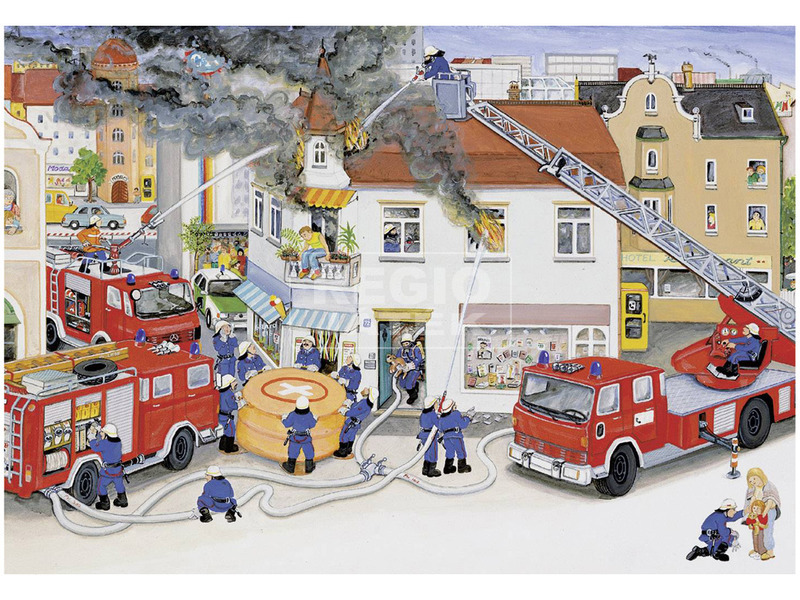
Where is `basket`? basket is located at coordinates (450, 94).